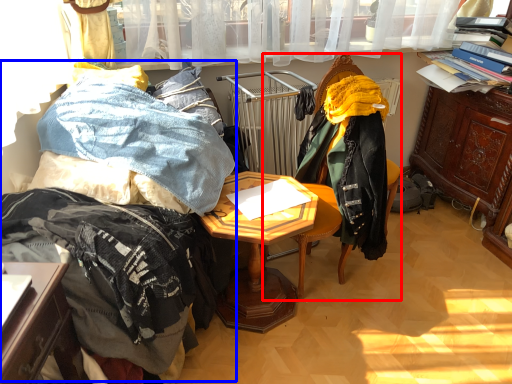
Question: Which of the following is the closest to the observer, chair (highlighted by a red box) or bed (highlighted by a blue box)?

Choices:
 (A) chair
 (B) bed

Answer: (B)